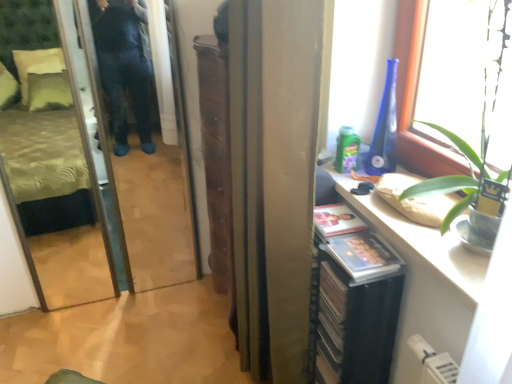
Question: Is satin gold curtain at center in contact with transparent glass window at upper right?

Choices:
 (A) no
 (B) yes

Answer: (A)

Question: Can you confirm if satin gold curtain at center is shorter than transparent glass window at upper right?

Choices:
 (A) no
 (B) yes

Answer: (A)

Question: Is satin gold curtain at center outside transparent glass window at upper right?

Choices:
 (A) no
 (B) yes

Answer: (B)

Question: From the image's perspective, would you say satin gold curtain at center is shown under transparent glass window at upper right?

Choices:
 (A) no
 (B) yes

Answer: (B)

Question: Is there a large distance between satin gold curtain at center and transparent glass window at upper right?

Choices:
 (A) no
 (B) yes

Answer: (A)

Question: From the image's perspective, is satin gold curtain at center over transparent glass window at upper right?

Choices:
 (A) yes
 (B) no

Answer: (B)

Question: Are satin gold curtain at center and transparent glass screen door at left beside each other?

Choices:
 (A) yes
 (B) no

Answer: (B)

Question: Is satin gold curtain at center to the left of transparent glass screen door at left from the viewer's perspective?

Choices:
 (A) no
 (B) yes

Answer: (A)

Question: Is satin gold curtain at center oriented towards transparent glass screen door at left?

Choices:
 (A) yes
 (B) no

Answer: (B)

Question: Considering the relative positions of satin gold curtain at center and transparent glass screen door at left in the image provided, is satin gold curtain at center to the right of transparent glass screen door at left from the viewer's perspective?

Choices:
 (A) no
 (B) yes

Answer: (B)

Question: Are satin gold curtain at center and transparent glass screen door at left located far from each other?

Choices:
 (A) yes
 (B) no

Answer: (B)

Question: From a real-world perspective, is satin gold curtain at center positioned over transparent glass screen door at left based on gravity?

Choices:
 (A) yes
 (B) no

Answer: (A)

Question: From a real-world perspective, is transparent glass screen door at left physically below satin gold curtain at center?

Choices:
 (A) yes
 (B) no

Answer: (A)